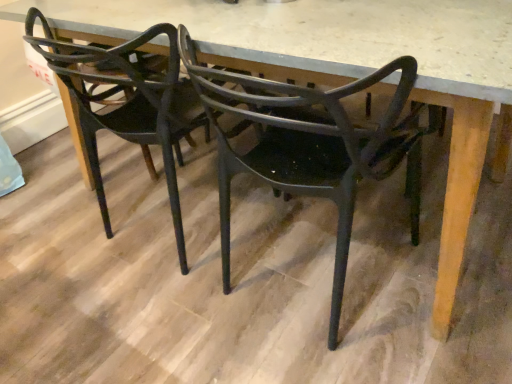
Question: Considering the positions of matte black chair at center, acting as the 1th chair starting from the left, and matte black chair at center, the 1th chair in the right-to-left sequence, in the image, is matte black chair at center, acting as the 1th chair starting from the left, taller or shorter than matte black chair at center, the 1th chair in the right-to-left sequence,?

Choices:
 (A) short
 (B) tall

Answer: (A)

Question: From the image's perspective, relative to matte black chair at center, the second chair from the left, is matte black chair at center, which appears as the second chair when viewed from the right, above or below?

Choices:
 (A) below
 (B) above

Answer: (B)

Question: Which is correct: matte black chair at center, acting as the 1th chair starting from the left, is inside matte black chair at center, the 1th chair in the right-to-left sequence, or outside of it?

Choices:
 (A) outside
 (B) inside

Answer: (A)

Question: From the image's perspective, is matte black chair at center, the 1th chair in the right-to-left sequence, located above or below matte black chair at center, acting as the 1th chair starting from the left?

Choices:
 (A) below
 (B) above

Answer: (A)

Question: Choose the correct answer: Is matte black chair at center, the second chair from the left, inside matte black chair at center, which appears as the second chair when viewed from the right, or outside it?

Choices:
 (A) outside
 (B) inside

Answer: (A)

Question: From a real-world perspective, is matte black chair at center, the second chair from the left, above or below matte black chair at center, which appears as the second chair when viewed from the right?

Choices:
 (A) below
 (B) above

Answer: (A)

Question: Is matte black chair at center, the second chair from the left, in front of or behind matte black chair at center, acting as the 1th chair starting from the left, in the image?

Choices:
 (A) front
 (B) behind

Answer: (A)